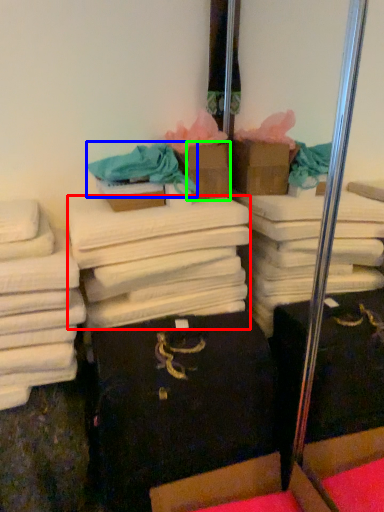
Question: Based on their relative distances, which object is nearer to bath towel (highlighted by a red box)? Choose from clothing (highlighted by a blue box) and cardboard box (highlighted by a green box).

Choices:
 (A) clothing
 (B) cardboard box

Answer: (A)